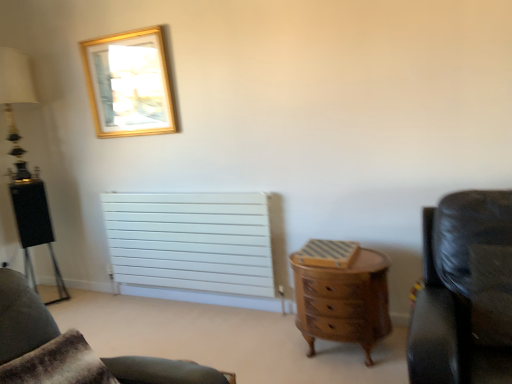
Question: From a real-world perspective, is matte black lamp at left physically below white matte radiator at center?

Choices:
 (A) no
 (B) yes

Answer: (A)

Question: Is matte black lamp at left wider than white matte radiator at center?

Choices:
 (A) yes
 (B) no

Answer: (A)

Question: Is matte black lamp at left in front of white matte radiator at center?

Choices:
 (A) yes
 (B) no

Answer: (B)

Question: Is white matte radiator at center at the back of matte black lamp at left?

Choices:
 (A) yes
 (B) no

Answer: (B)

Question: From a real-world perspective, is matte black lamp at left positioned over white matte radiator at center based on gravity?

Choices:
 (A) no
 (B) yes

Answer: (B)

Question: Are matte black lamp at left and white matte radiator at center located far from each other?

Choices:
 (A) yes
 (B) no

Answer: (A)

Question: Is brown fur pillow at lower left at the left side of leather couch at lower right, which appears as the first chair when ordered from the bottom?

Choices:
 (A) yes
 (B) no

Answer: (B)

Question: Does brown fur pillow at lower left come in front of leather couch at lower right, marked as the second chair in a top-to-bottom arrangement?

Choices:
 (A) yes
 (B) no

Answer: (A)

Question: Is brown fur pillow at lower left positioned with its back to leather couch at lower right, which is the 1th chair from left to right?

Choices:
 (A) yes
 (B) no

Answer: (B)

Question: From the image's perspective, would you say brown fur pillow at lower left is shown under leather couch at lower right, marked as the second chair in a front-to-back arrangement?

Choices:
 (A) no
 (B) yes

Answer: (A)

Question: Are brown fur pillow at lower left and leather couch at lower right, which appears as the first chair when ordered from the bottom, located far from each other?

Choices:
 (A) no
 (B) yes

Answer: (A)

Question: Is brown fur pillow at lower left beside leather couch at lower right, which is the 1th chair from left to right?

Choices:
 (A) yes
 (B) no

Answer: (B)

Question: Is black leather chair at right, placed as the 2th chair when sorted from back to front, outside of white matte radiator at center?

Choices:
 (A) yes
 (B) no

Answer: (A)